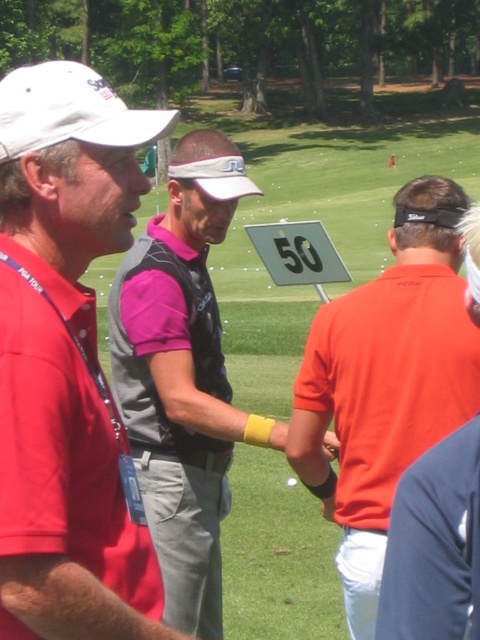
You are a photographer standing at the back of the golf course. You want to take a photo of the white matte cap at upper left and the pink fabric shirt at center. Based on their positions, will the cap block the view of the shirt in the photo?

The white matte cap at upper left is above the pink fabric shirt at center, so the cap will not block the view of the shirt in the photo since it is positioned above it.

You are a photographer trying to capture a group photo of the white matte cap at upper left and the orange matte shirt at center. Since you want to ensure both subjects are in the frame, can you confirm if they are positioned side by side horizontally?

The white matte cap at upper left is to the left of the orange matte shirt at center, so they are positioned side by side horizontally.